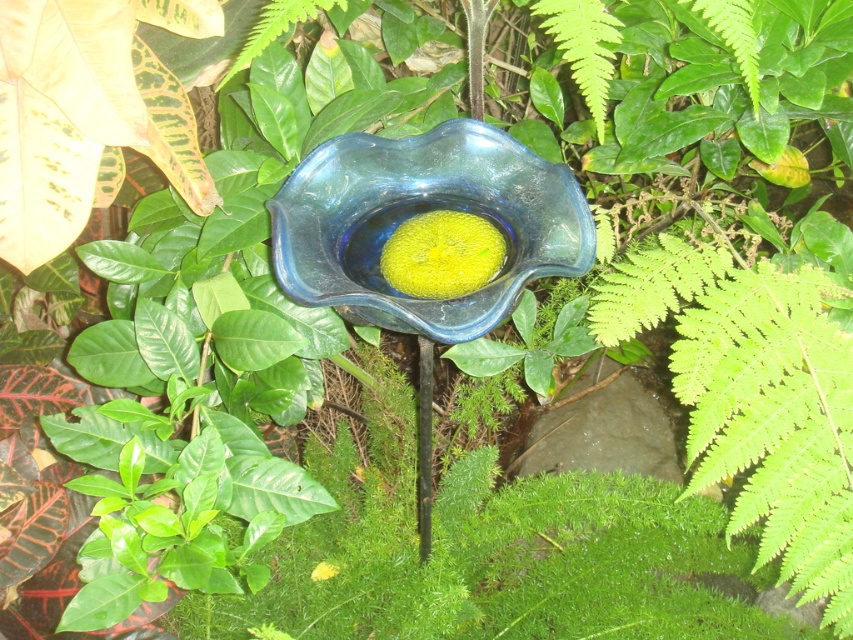
Question: Among these points, which one is nearest to the camera?

Choices:
 (A) (416, 147)
 (B) (322, 577)

Answer: (A)

Question: Can you confirm if blue glass bowl at center is positioned to the left of yellow matte flower at center?

Choices:
 (A) yes
 (B) no

Answer: (B)

Question: Where is blue glass bowl at center located in relation to yellow matte flower at center in the image?

Choices:
 (A) left
 (B) right

Answer: (B)

Question: Can you confirm if blue glass bowl at center is positioned to the left of yellow matte flower at center?

Choices:
 (A) yes
 (B) no

Answer: (B)

Question: Among these points, which one is nearest to the camera?

Choices:
 (A) (288, 276)
 (B) (329, 563)

Answer: (A)